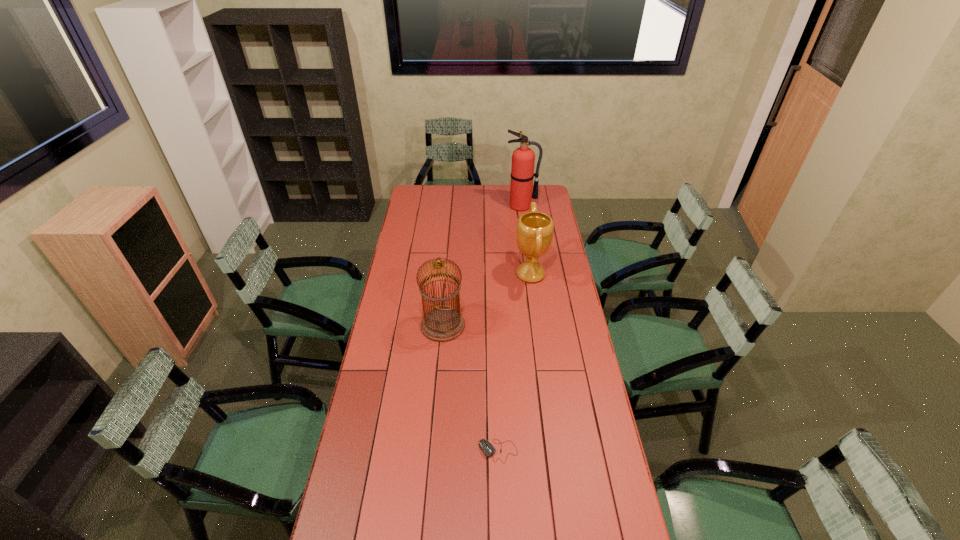
Identify the location of vacant space situated 0.260m on the front of the award with the decoration. This screenshot has height=540, width=960. (460, 274).

At what (x,y) coordinates should I click in order to perform the action: click on blank space located 0.260m on the front of the award with the decoration. Please return your answer as a coordinate pair (x, y). Image resolution: width=960 pixels, height=540 pixels. Looking at the image, I should click on (460, 274).

Locate an element on the screen. vacant position located 0.220m on the right of the shortest object is located at coordinates (583, 451).

Identify the location of object present at the far edge. (523, 158).

Locate an element on the screen. fire extinguisher that is at the right edge is located at coordinates (523, 158).

Locate an element on the screen. award that is at the right edge is located at coordinates (534, 230).

You are a GUI agent. You are given a task and a screenshot of the screen. Output one action in this format:
    pyautogui.click(x=<x>, y=<y>)
    Task: Click on the object that is at the far right corner
    Image resolution: width=960 pixels, height=540 pixels.
    Given the screenshot: What is the action you would take?
    pyautogui.click(x=523, y=158)

In the image, there is a desktop. Where is `free region at the far edge`? free region at the far edge is located at coordinates (460, 198).

I want to click on free space at the left edge, so click(418, 247).

This screenshot has height=540, width=960. What are the coordinates of `vacant space at the right edge` in the screenshot? It's located at (555, 389).